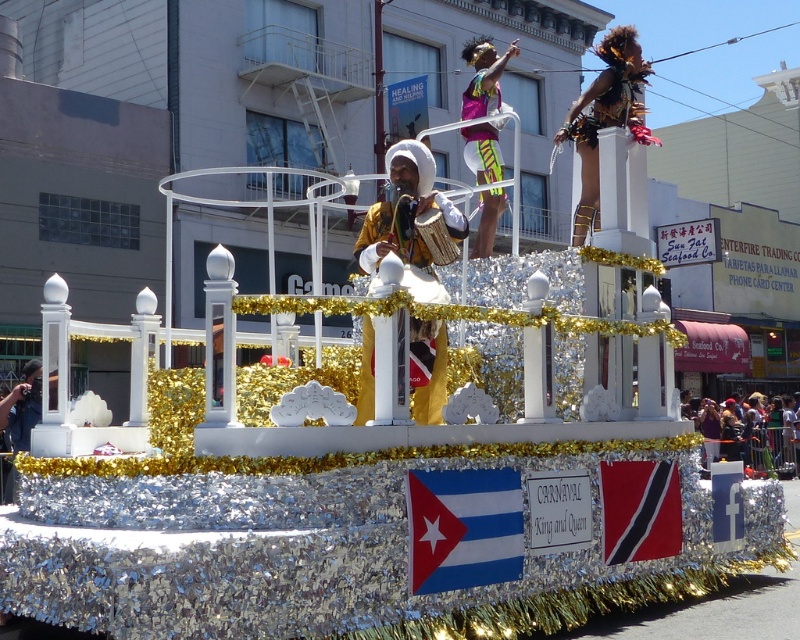
Can you confirm if matte gold robe at center is positioned above neon yellow fabric at center?

Actually, matte gold robe at center is below neon yellow fabric at center.

Between point (418, 353) and point (474, 40), which one is positioned behind?

Point (474, 40)

Describe the element at coordinates (408, 218) in the screenshot. I see `matte gold robe at center` at that location.

The height and width of the screenshot is (640, 800). What are the coordinates of `matte gold robe at center` in the screenshot? It's located at (408, 218).

Who is positioned more to the left, matte black camera at lower right or neon yellow fabric at center?

neon yellow fabric at center is more to the left.

Can you confirm if matte black camera at lower right is positioned to the left of neon yellow fabric at center?

In fact, matte black camera at lower right is to the right of neon yellow fabric at center.

Is point (710, 400) positioned behind point (478, 172)?

Yes, point (710, 400) is behind point (478, 172).

You are a GUI agent. You are given a task and a screenshot of the screen. Output one action in this format:
    pyautogui.click(x=<x>, y=<y>)
    Task: Click on the matte black camera at lower right
    This screenshot has height=640, width=800.
    Given the screenshot: What is the action you would take?
    coord(752,435)

Is matte gold robe at center bigger than matte black camera at lower right?

Actually, matte gold robe at center might be smaller than matte black camera at lower right.

Which is in front, point (362, 390) or point (794, 449)?

Point (362, 390)

Identify the location of matte gold robe at center. The width and height of the screenshot is (800, 640). (408, 218).